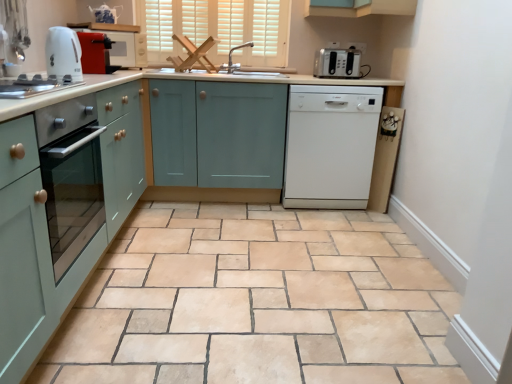
Question: Can you confirm if white glossy dishwasher at center, which is the 2th home appliance in front-to-back order, is taller than teal matte cabinet at center, acting as the 2th cabinetry starting from the left?

Choices:
 (A) yes
 (B) no

Answer: (B)

Question: Is white glossy dishwasher at center, which is the 2th home appliance in front-to-back order, touching teal matte cabinet at center, acting as the 2th cabinetry starting from the left?

Choices:
 (A) yes
 (B) no

Answer: (B)

Question: Is white glossy dishwasher at center, which is the 2th home appliance in front-to-back order, shorter than teal matte cabinet at center, which is the 1th cabinetry in right-to-left order?

Choices:
 (A) no
 (B) yes

Answer: (B)

Question: Is white glossy dishwasher at center, acting as the 2th home appliance starting from the left, at the left side of teal matte cabinet at center, acting as the 2th cabinetry starting from the left?

Choices:
 (A) yes
 (B) no

Answer: (B)

Question: From the image's perspective, is matte red toaster at upper left, which is the 2th kitchen appliance from top to bottom, located above or below silver metallic faucet at center?

Choices:
 (A) below
 (B) above

Answer: (A)

Question: In terms of size, does matte red toaster at upper left, which is the 2th kitchen appliance from top to bottom, appear bigger or smaller than silver metallic faucet at center?

Choices:
 (A) big
 (B) small

Answer: (B)

Question: Considering the relative positions of matte red toaster at upper left, the 3th kitchen appliance in the right-to-left sequence, and silver metallic faucet at center in the image provided, is matte red toaster at upper left, the 3th kitchen appliance in the right-to-left sequence, to the left or to the right of silver metallic faucet at center?

Choices:
 (A) left
 (B) right

Answer: (A)

Question: Is point (96, 56) positioned closer to the camera than point (228, 56)?

Choices:
 (A) closer
 (B) farther

Answer: (A)

Question: Is point pyautogui.click(x=158, y=21) closer or farther from the camera than point pyautogui.click(x=228, y=52)?

Choices:
 (A) closer
 (B) farther

Answer: (A)

Question: From their relative heights in the image, would you say white matte window at upper center is taller or shorter than silver metallic faucet at center?

Choices:
 (A) tall
 (B) short

Answer: (A)

Question: Visually, is white matte window at upper center positioned to the left or to the right of silver metallic faucet at center?

Choices:
 (A) left
 (B) right

Answer: (A)

Question: Do you think white matte window at upper center is within silver metallic faucet at center, or outside of it?

Choices:
 (A) inside
 (B) outside

Answer: (B)

Question: Is point (57, 62) closer or farther from the camera than point (34, 269)?

Choices:
 (A) closer
 (B) farther

Answer: (B)

Question: Looking at the image, does white glossy electric kettle at upper left, the 1th home appliance in the left-to-right sequence, seem bigger or smaller compared to matte teal cabinet at left, which is counted as the second cabinetry, starting from the right?

Choices:
 (A) small
 (B) big

Answer: (A)